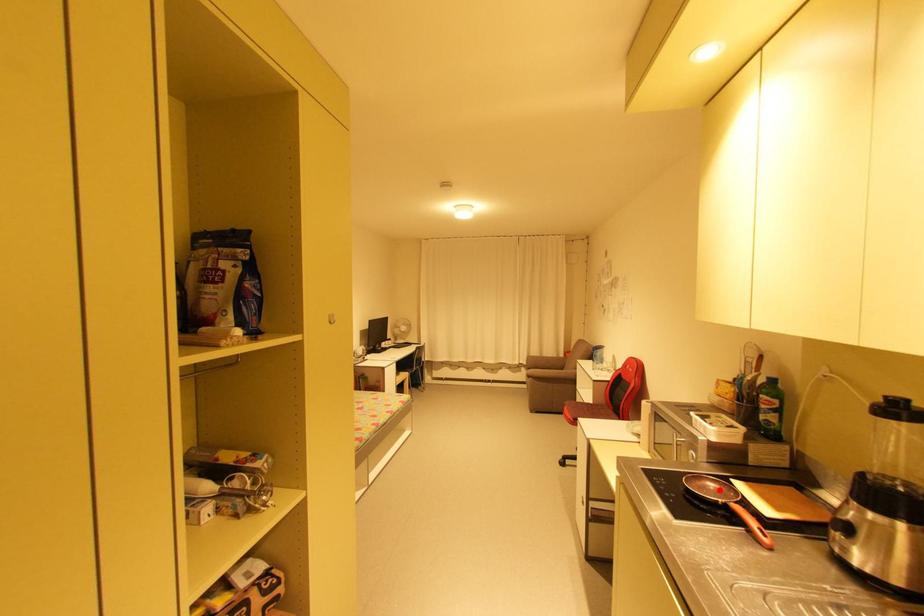
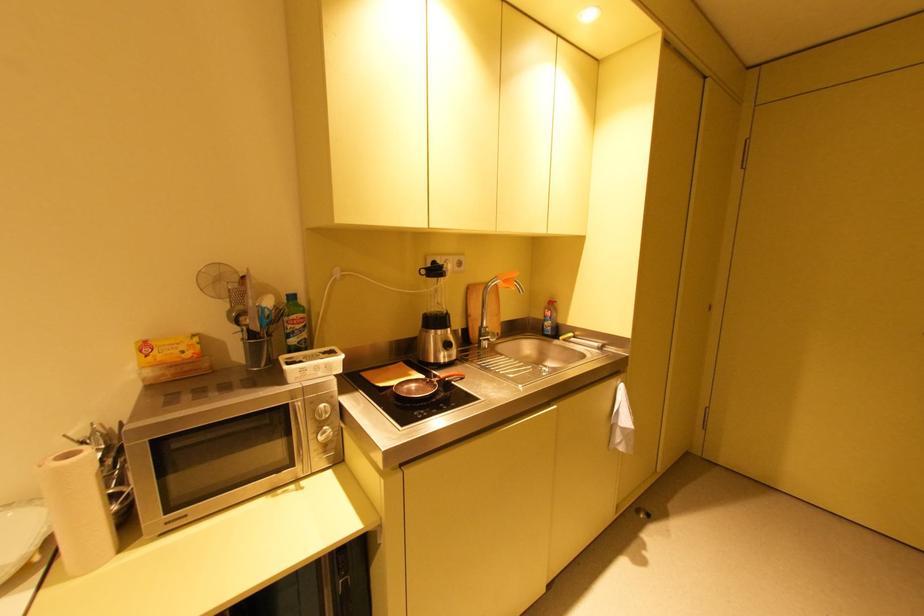
In the second image, find the point that corresponds to the highlighted location in the first image.

(420, 387)